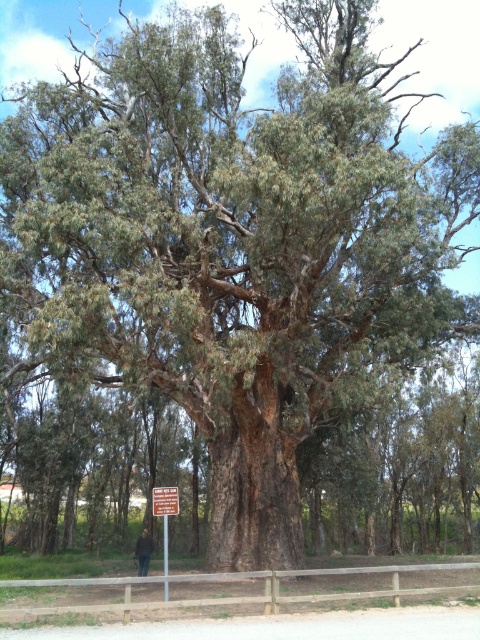
From the picture: Does brown wooden signpost at center lie in front of brown leather jacket at center?

Yes, brown wooden signpost at center is in front of brown leather jacket at center.

Consider the image. Who is more distant from viewer, (168, 499) or (136, 544)?

Point (136, 544)

Where is `brown wooden signpost at center`? Image resolution: width=480 pixels, height=640 pixels. brown wooden signpost at center is located at coordinates (165, 513).

Where is `brown wooden signpost at center`? This screenshot has width=480, height=640. brown wooden signpost at center is located at coordinates (165, 513).

Between red plastic sign at center and brown leather jacket at center, which one has more height?

red plastic sign at center

Which is more to the left, red plastic sign at center or brown leather jacket at center?

brown leather jacket at center is more to the left.

Between point (166, 513) and point (140, 538), which one is positioned in front?

Point (166, 513) is more forward.

What are the coordinates of `red plastic sign at center` in the screenshot? It's located at (165, 500).

Who is positioned more to the left, brown wooden signpost at center or red plastic sign at center?

red plastic sign at center

Is brown wooden signpost at center to the left of red plastic sign at center from the viewer's perspective?

No, brown wooden signpost at center is not to the left of red plastic sign at center.

What are the coordinates of `brown wooden signpost at center` in the screenshot? It's located at (165, 513).

Locate an element on the screen. The width and height of the screenshot is (480, 640). brown wooden signpost at center is located at coordinates (165, 513).